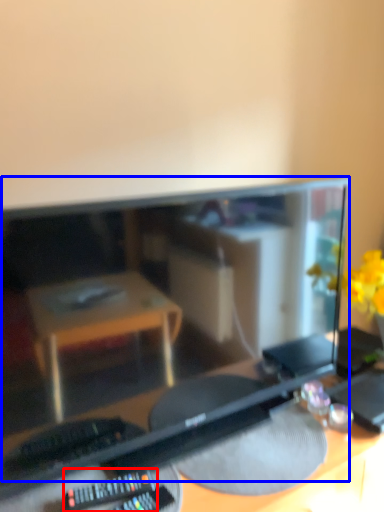
Question: Which object is further to the camera taking this photo, control (highlighted by a red box) or computer monitor (highlighted by a blue box)?

Choices:
 (A) control
 (B) computer monitor

Answer: (A)